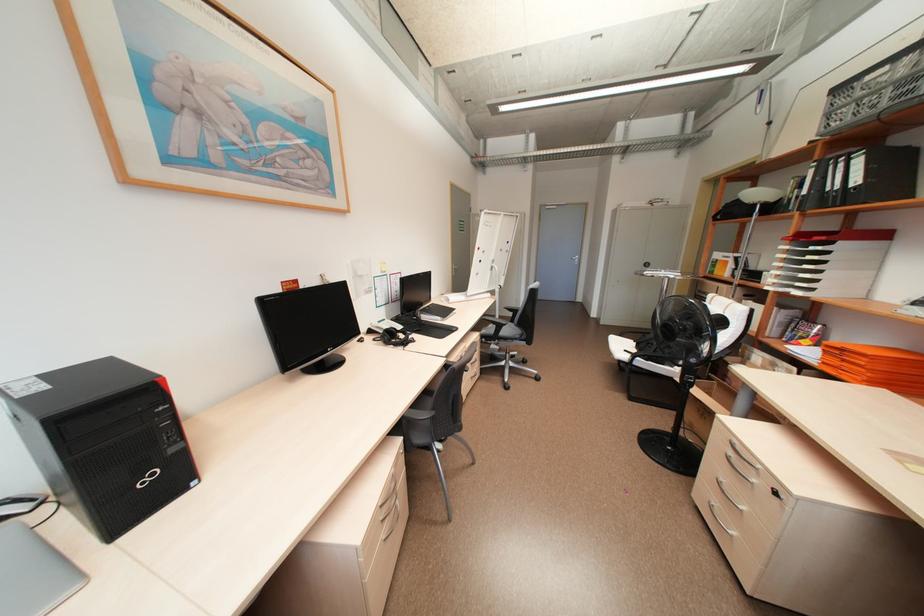
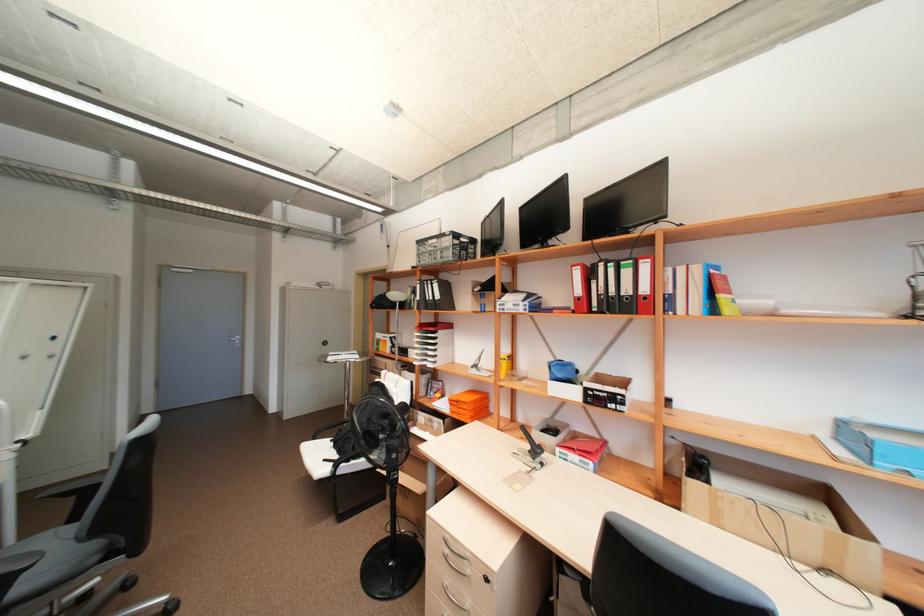
Find the pixel in the second image that matches [830,100] in the first image.

(420, 246)